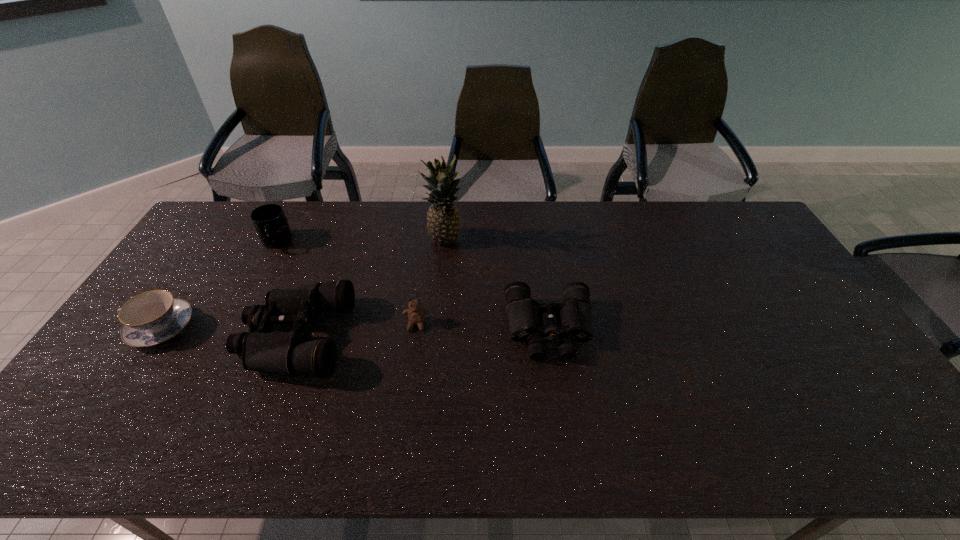
Considering the uniform spacing of binocularss, where should an additional binoculars be positioned on the right? Please locate a free spot. Please provide its 2D coordinates. Your answer should be formatted as a tuple, i.e. [(x, y)], where the tuple contains the x and y coordinates of a point satisfying the conditions above.

[(796, 321)]